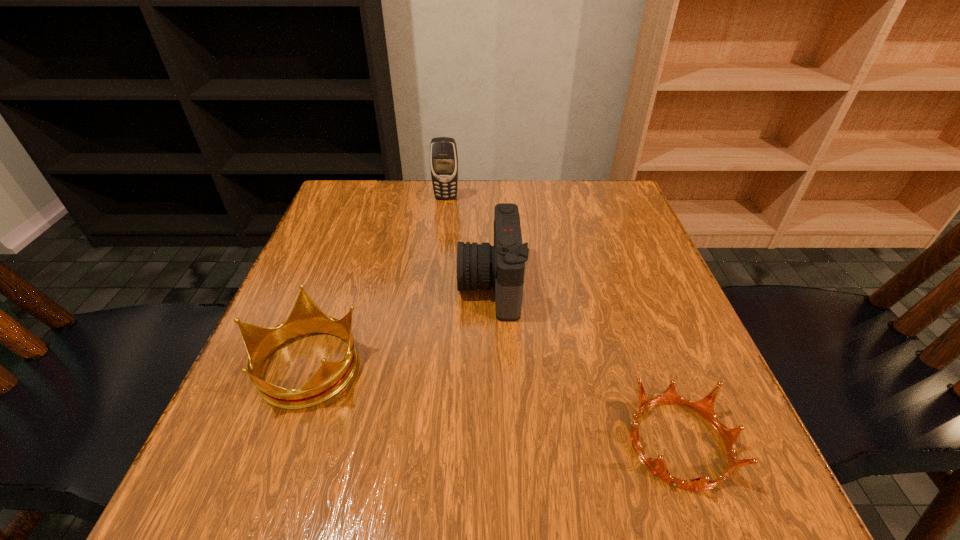
Identify the location of free location that satisfies the following two spatial constraints: 1. at the lens of the right crown; 2. on the left side of the camera. This screenshot has height=540, width=960. (494, 443).

At what (x,y) coordinates should I click in order to perform the action: click on vacant space that satisfies the following two spatial constraints: 1. at the lens of the third nearest object; 2. on the left side of the right crown. Please return your answer as a coordinate pair (x, y). The width and height of the screenshot is (960, 540). Looking at the image, I should click on (494, 443).